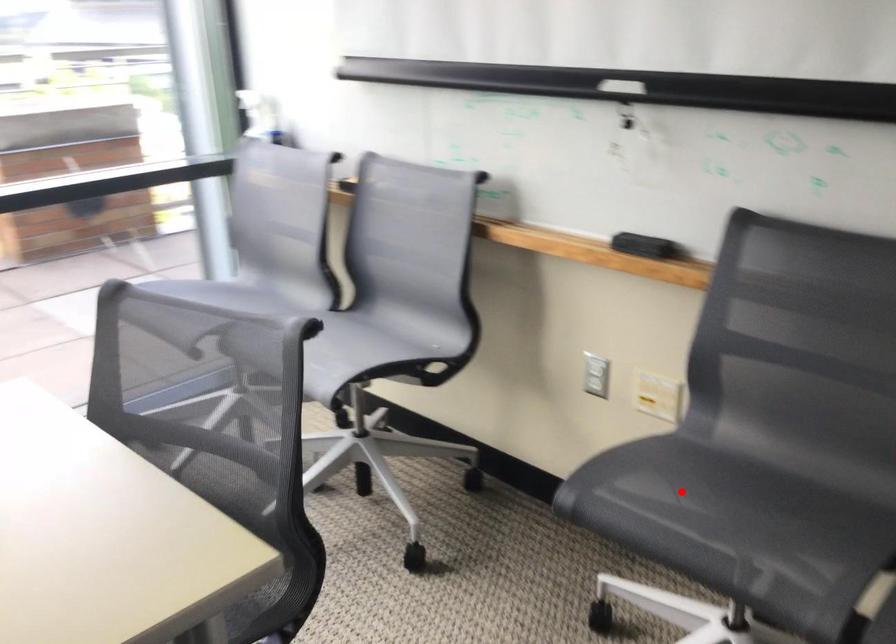
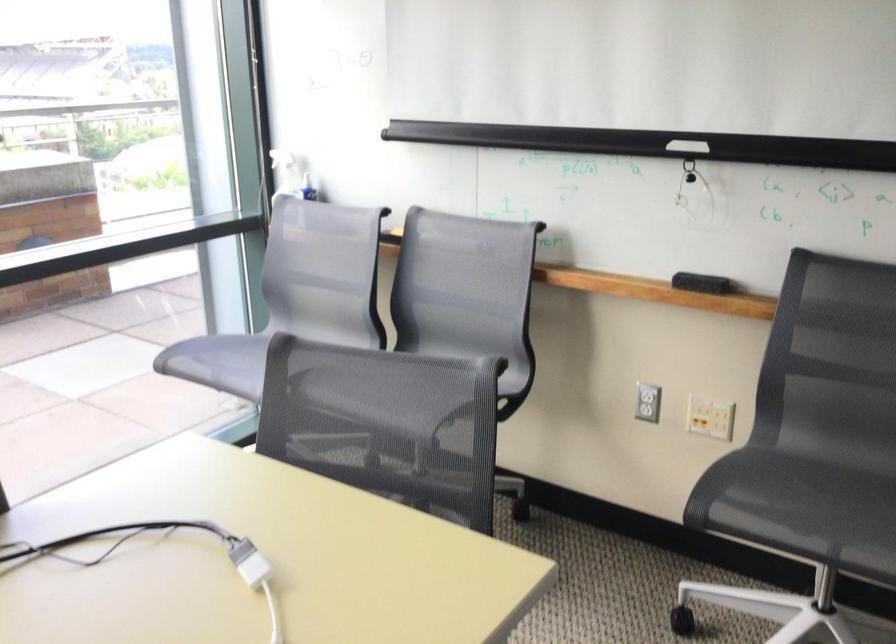
Question: A red point is marked in image1. In image2, is the corresponding 3D point closer to the camera or farther? Reply with the corresponding letter.

Choices:
 (A) The corresponding 3D point is closer.
 (B) The corresponding 3D point is farther.

Answer: (B)